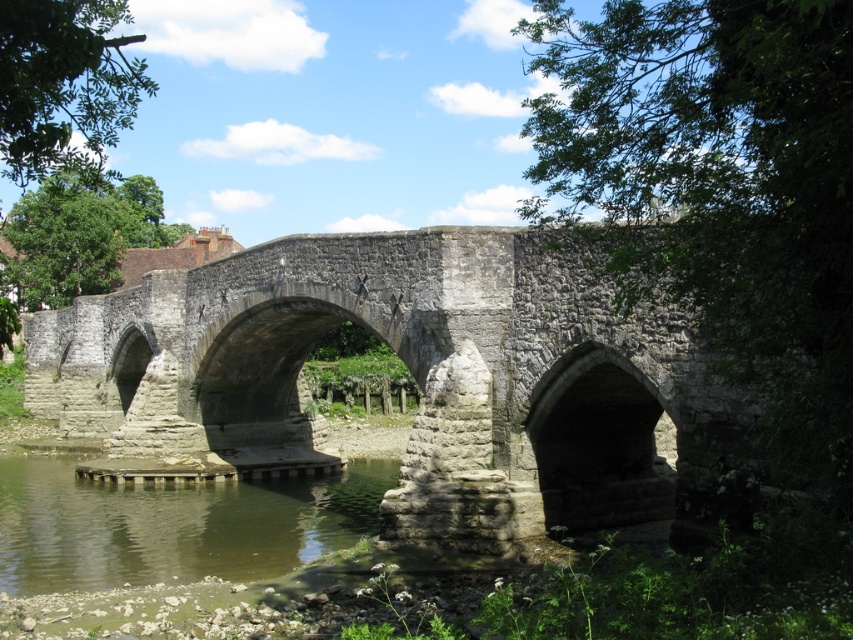
Question: Considering the relative positions of stone bridge at center and green murky water at lower left in the image provided, where is stone bridge at center located with respect to green murky water at lower left?

Choices:
 (A) left
 (B) right

Answer: (A)

Question: Is stone bridge at center above green murky water at lower left?

Choices:
 (A) no
 (B) yes

Answer: (B)

Question: Which object is farther from the camera taking this photo?

Choices:
 (A) stone bridge at center
 (B) green murky water at lower left

Answer: (B)

Question: Which object is farther from the camera taking this photo?

Choices:
 (A) green murky water at lower left
 (B) stone bridge at center

Answer: (A)

Question: Is stone bridge at center smaller than green murky water at lower left?

Choices:
 (A) yes
 (B) no

Answer: (B)